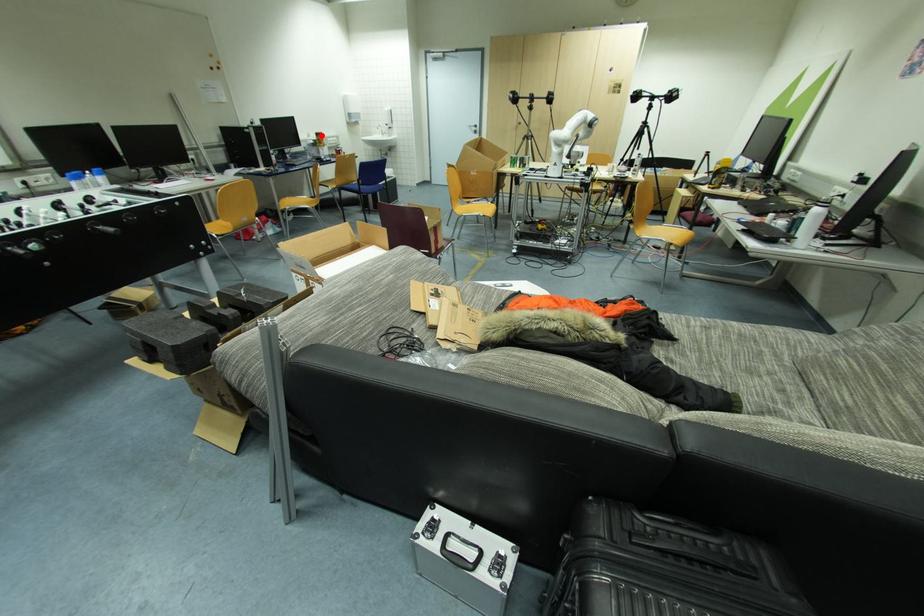
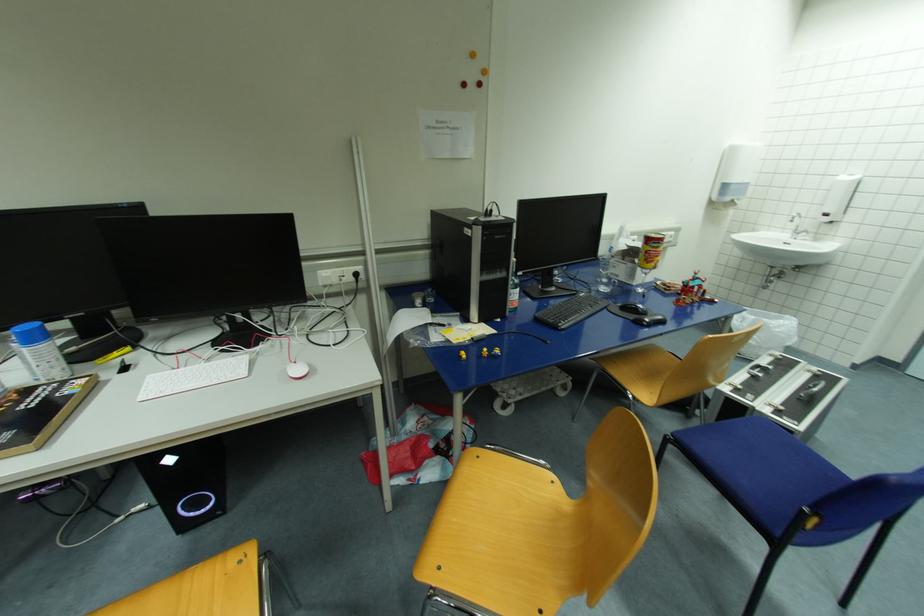
Where in the second image is the point corresponding to the highlighted location from the first image?

(653, 241)